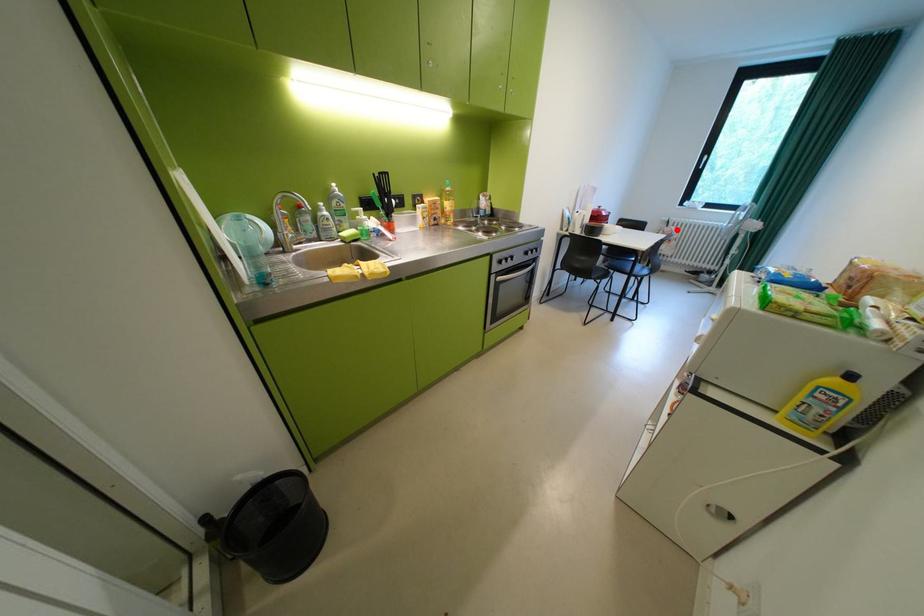
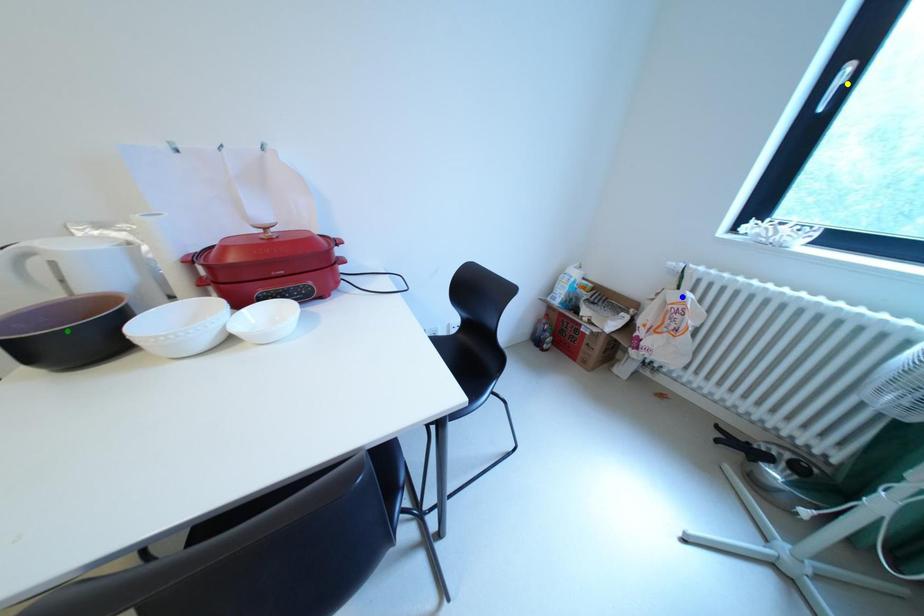
Question: I am providing you with two images of the same scene from different viewpoints. A red point is marked on the first image. You are given multiple points on the second image. Can you choose the point in image 2 that corresponds to the point in image 1?

Choices:
 (A) yellow point
 (B) green point
 (C) blue point

Answer: (C)